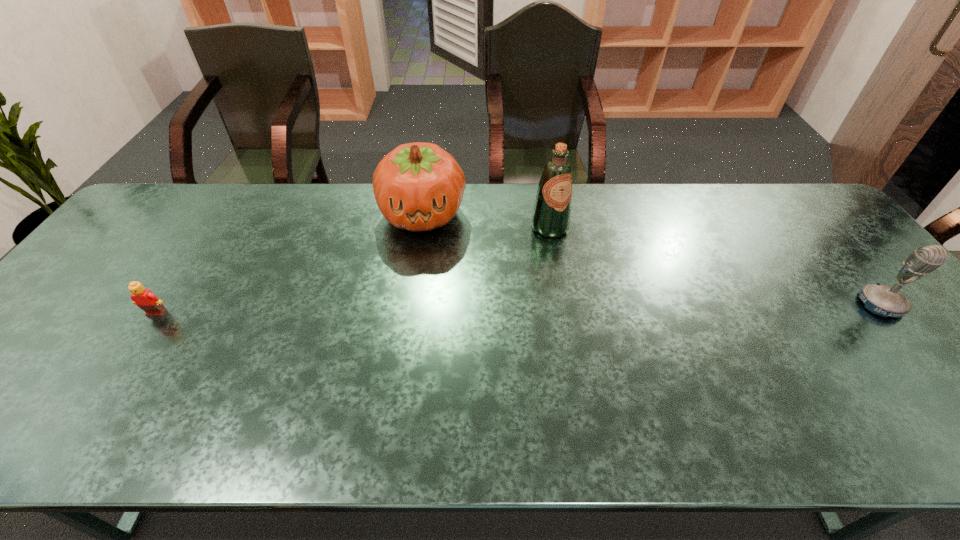
In order to click on vacant space in between the shortest object and the third object from right to left in this screenshot , I will do `click(289, 264)`.

Find the location of a particular element. This screenshot has height=540, width=960. free space between the leftmost object and the olive oil is located at coordinates (353, 271).

Image resolution: width=960 pixels, height=540 pixels. Identify the location of unoccupied area between the pumpkin and the second shortest object. (652, 259).

Where is `object identified as the third closest to the rightmost object`? This screenshot has width=960, height=540. object identified as the third closest to the rightmost object is located at coordinates (143, 298).

Select which object appears as the third closest to the rightmost object. Please provide its 2D coordinates. Your answer should be formatted as a tuple, i.e. [(x, y)], where the tuple contains the x and y coordinates of a point satisfying the conditions above.

[(143, 298)]